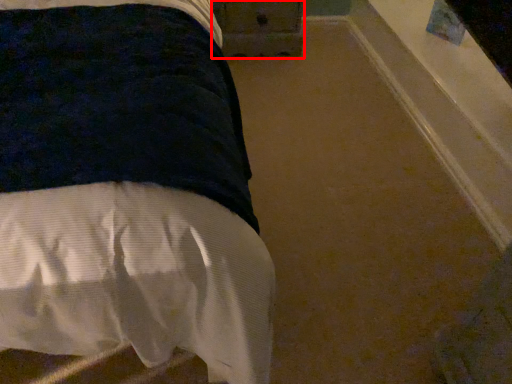
Question: From the image's perspective, what is the correct spatial relationship of drawer (annotated by the red box) in relation to bed?

Choices:
 (A) below
 (B) above

Answer: (B)